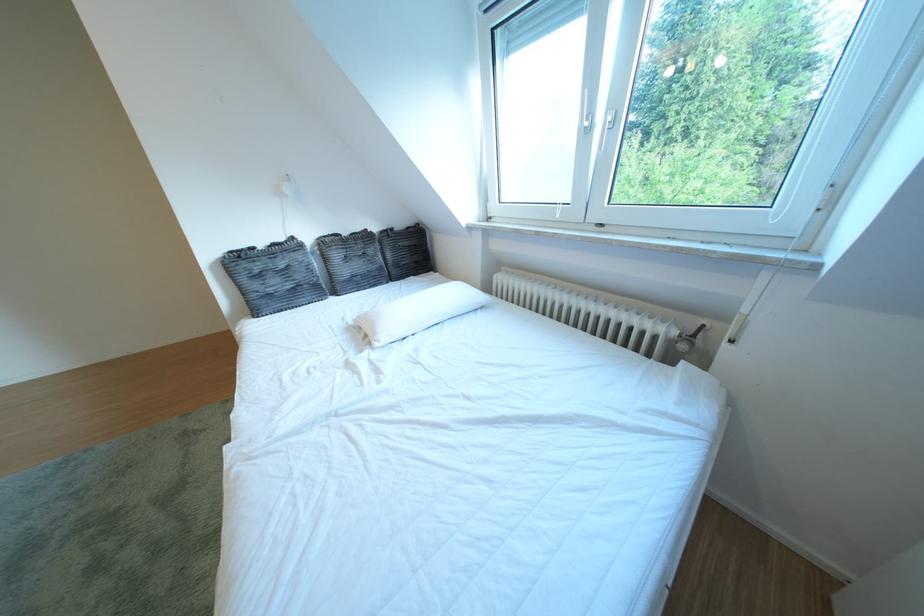
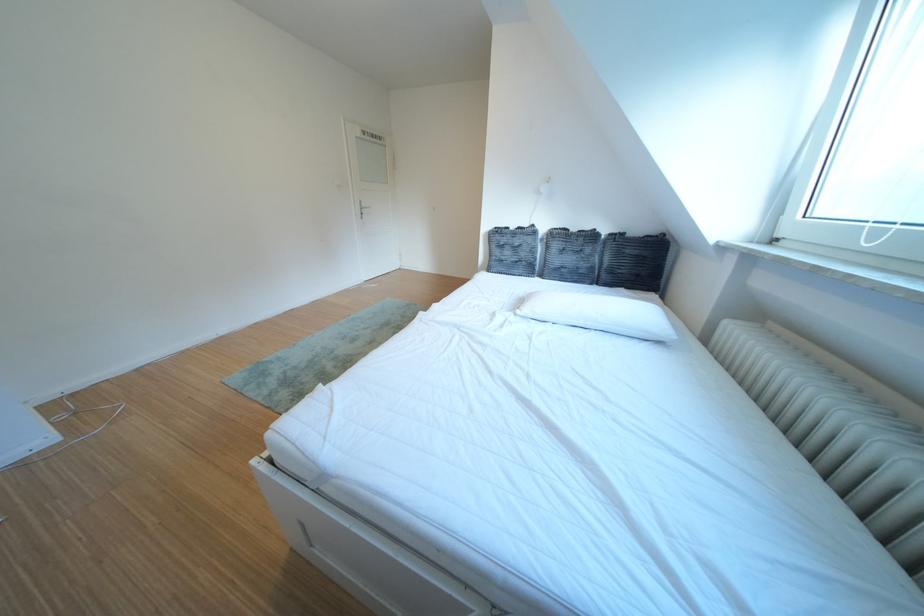
The point at (396, 342) is marked in the first image. Where is the corresponding point in the second image?

(540, 314)